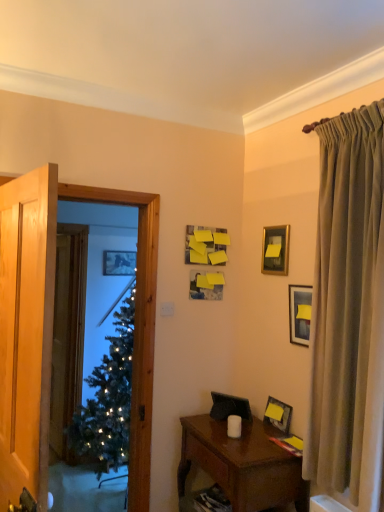
This screenshot has width=384, height=512. Identify the location of free spot to the right of white matte candle at center. (261, 439).